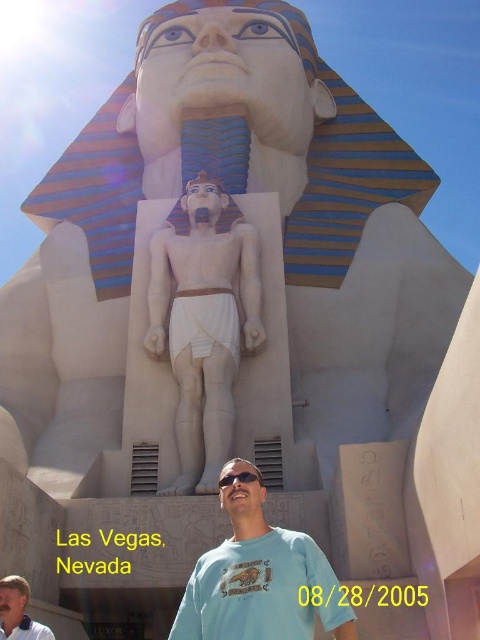
Is white marble statue at center bigger than black plastic goggles at center?

Yes, white marble statue at center is bigger than black plastic goggles at center.

How far apart are white marble statue at center and black plastic goggles at center?

They are 25.14 meters apart.

The height and width of the screenshot is (640, 480). I want to click on white marble statue at center, so click(x=204, y=323).

Can you confirm if light blue t-shirt at center is positioned to the left of black plastic goggles at center?

Correct, you'll find light blue t-shirt at center to the left of black plastic goggles at center.

In the scene shown: Who is positioned more to the right, light blue t-shirt at center or black plastic goggles at center?

Positioned to the right is black plastic goggles at center.

Identify the location of light blue t-shirt at center. (261, 580).

Can you confirm if light blue t-shirt at center is positioned to the right of light blue t-shirt at lower center?

Indeed, light blue t-shirt at center is positioned on the right side of light blue t-shirt at lower center.

Find the location of a particular element. This screenshot has width=480, height=640. light blue t-shirt at center is located at coordinates (261, 580).